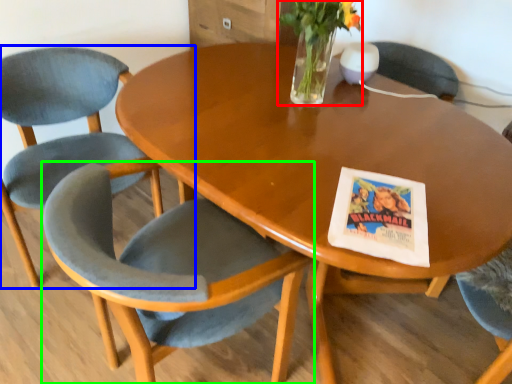
Question: Which object is the farthest from floral arrangement (highlighted by a red box)? Choose among these: chair (highlighted by a blue box) or chair (highlighted by a green box).

Choices:
 (A) chair
 (B) chair

Answer: (A)